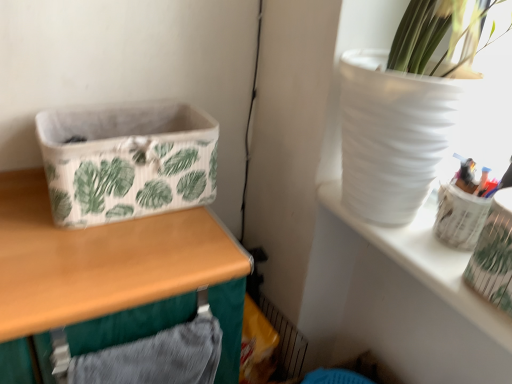
Question: From a real-world perspective, is wooden table at left positioned above or below white matte vase at upper right?

Choices:
 (A) below
 (B) above

Answer: (A)

Question: Is wooden table at left spatially inside white matte vase at upper right, or outside of it?

Choices:
 (A) outside
 (B) inside

Answer: (A)

Question: Estimate the real-world distances between objects in this image. Which object is closer to the white matte vase at upper right?

Choices:
 (A) wooden table at left
 (B) translucent plastic pen holder at upper right
 (C) white fabric basket at left

Answer: (B)

Question: Estimate the real-world distances between objects in this image. Which object is farther from the white fabric basket at left?

Choices:
 (A) translucent plastic pen holder at upper right
 (B) wooden table at left
 (C) white matte vase at upper right

Answer: (A)